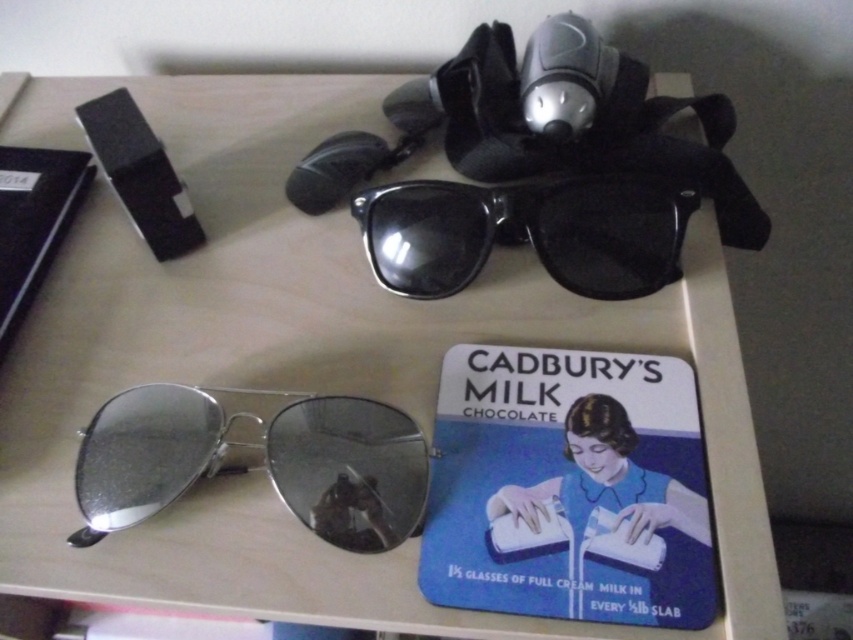
Question: Does silver reflective aviator sunglasses at bottom left appear over black plastic sunglasses at center?

Choices:
 (A) yes
 (B) no

Answer: (B)

Question: Where is silver reflective aviator sunglasses at bottom left located in relation to black plastic sunglasses at center in the image?

Choices:
 (A) left
 (B) right

Answer: (A)

Question: Can you confirm if silver reflective aviator sunglasses at bottom left is bigger than black plastic sunglasses at center?

Choices:
 (A) no
 (B) yes

Answer: (B)

Question: Which of the following is the farthest from the observer?

Choices:
 (A) (357, 467)
 (B) (415, 230)

Answer: (B)